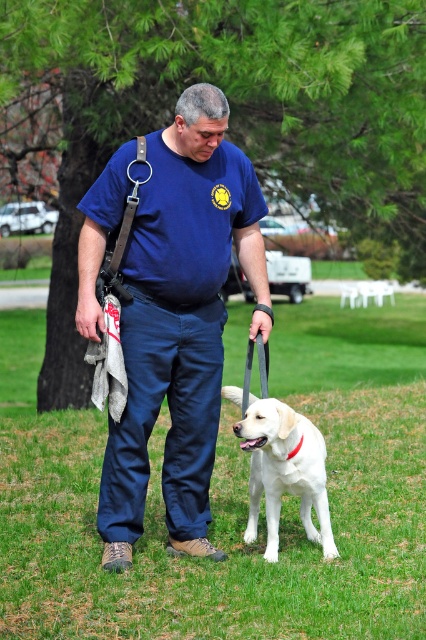
Does green grass at center appear on the left side of white matte dog at center?

Yes, green grass at center is to the left of white matte dog at center.

Does green grass at center appear on the right side of white matte dog at center?

Incorrect, green grass at center is not on the right side of white matte dog at center.

Find the location of a particular element. green grass at center is located at coordinates (229, 499).

Is point (408, 573) more distant than point (255, 324)?

No, it is in front of (255, 324).

Locate an element on the screen. The image size is (426, 640). green grass at center is located at coordinates (229, 499).

Is blue cotton shirt at center thinner than white matte dog at center?

In fact, blue cotton shirt at center might be wider than white matte dog at center.

Is blue cotton shirt at center taller than white matte dog at center?

Yes, blue cotton shirt at center is taller than white matte dog at center.

Identify the location of blue cotton shirt at center. The image size is (426, 640). (180, 323).